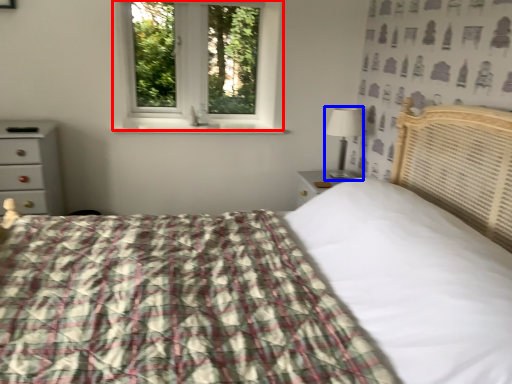
Question: Among these objects, which one is farthest to the camera, window (highlighted by a red box) or table lamp (highlighted by a blue box)?

Choices:
 (A) window
 (B) table lamp

Answer: (A)